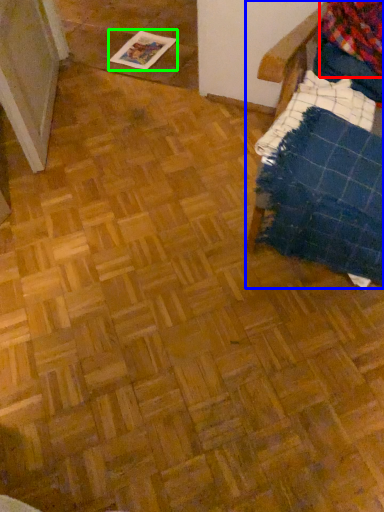
Question: Considering the real-world distances, which object is closest to flannel (highlighted by a red box)? furniture (highlighted by a blue box) or magazine (highlighted by a green box).

Choices:
 (A) furniture
 (B) magazine

Answer: (A)